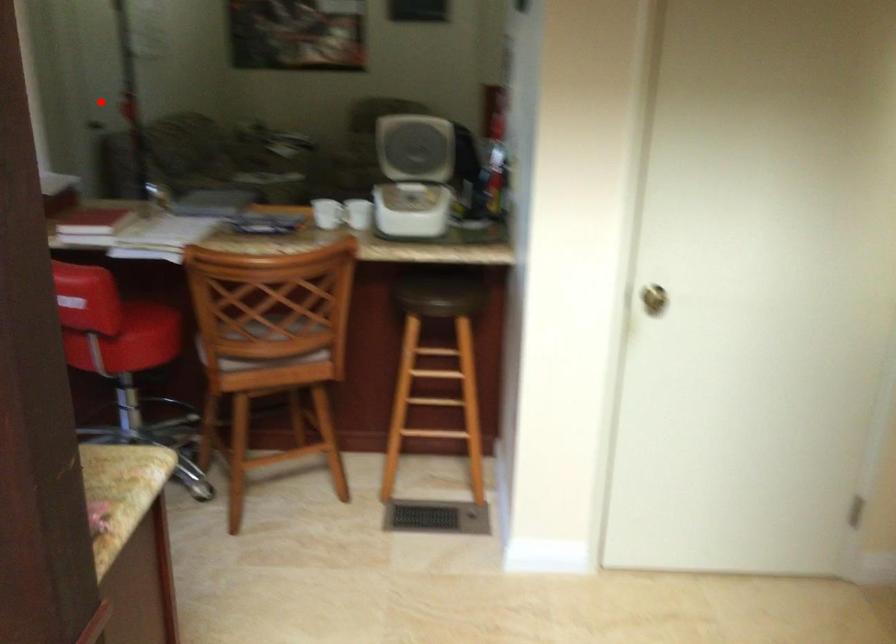
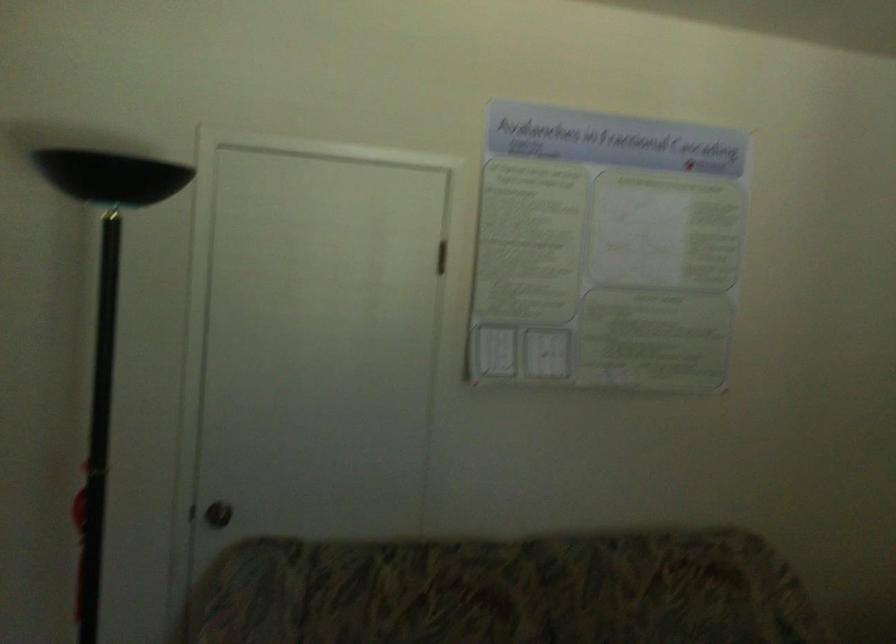
Question: I am providing you with two images of the same scene from different viewpoints. A red point is marked on the first image. Is the red point's position out of view in image 2?

Choices:
 (A) Yes
 (B) No

Answer: (B)